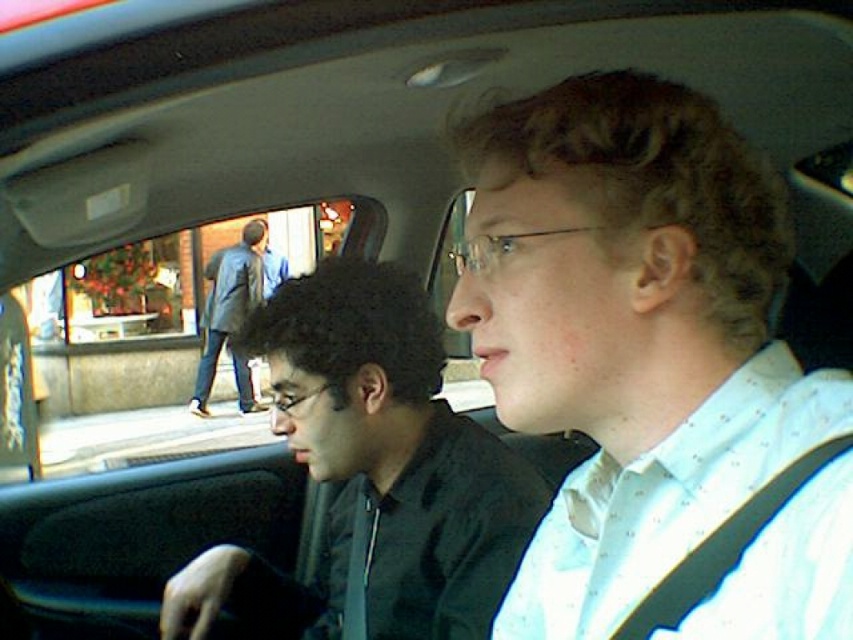
Is white dotted shirt at center to the left of dark gray coat at center from the viewer's perspective?

No, white dotted shirt at center is not to the left of dark gray coat at center.

Which of these two, white dotted shirt at center or dark gray coat at center, stands shorter?

white dotted shirt at center is shorter.

Who is more forward, (613,272) or (241,273)?

Point (613,272) is in front.

Where is `white dotted shirt at center`? The height and width of the screenshot is (640, 853). white dotted shirt at center is located at coordinates (653, 369).

Between black matte shirt at center and dark gray coat at center, which one appears on the right side from the viewer's perspective?

From the viewer's perspective, black matte shirt at center appears more on the right side.

Between point (218, 550) and point (247, 368), which one is positioned behind?

The point (247, 368) is behind.

This screenshot has height=640, width=853. What are the coordinates of `black matte shirt at center` in the screenshot? It's located at (372, 472).

Is point (786, 384) positioned in front of point (439, 448)?

Yes, it is in front of point (439, 448).

Who is more distant from viewer, [495,355] or [337,614]?

Point [337,614]

Who is more distant from viewer, (x=729, y=124) or (x=294, y=445)?

Point (x=294, y=445)

Find the location of a particular element. The image size is (853, 640). white dotted shirt at center is located at coordinates (653, 369).